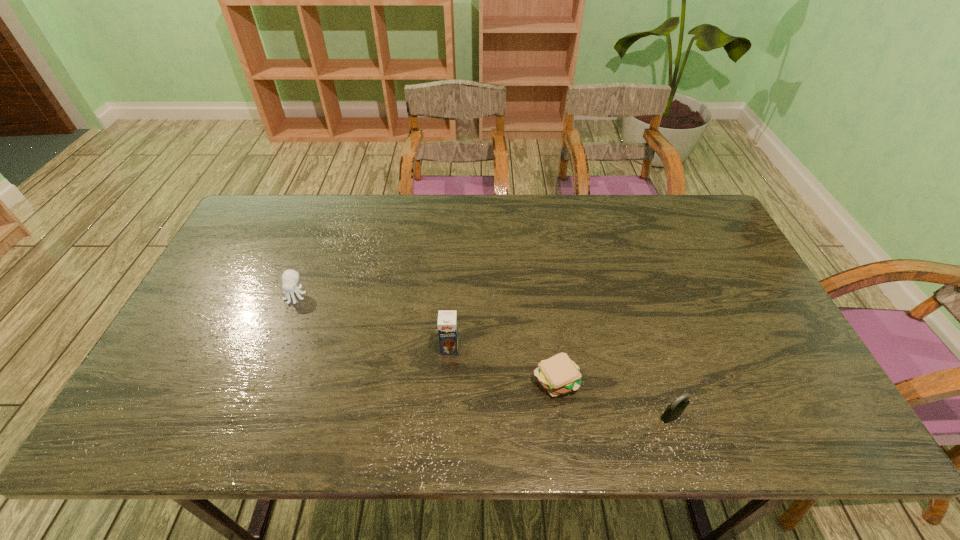
Locate an element on the screen. Image resolution: width=960 pixels, height=540 pixels. vacant space that satisfies the following two spatial constraints: 1. on the front-facing side of the leftmost object; 2. on the left side of the nearest object is located at coordinates (249, 416).